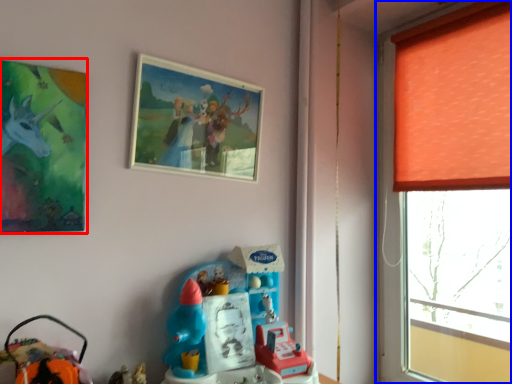
Question: Which of the following is the farthest to the observer, picture frame (highlighted by a red box) or window (highlighted by a blue box)?

Choices:
 (A) picture frame
 (B) window

Answer: (B)